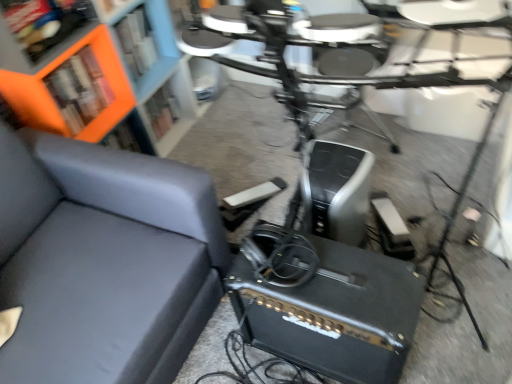
Question: Can we say orange matte bookcase at upper left lies outside matte gray couch at left?

Choices:
 (A) yes
 (B) no

Answer: (A)

Question: Does orange matte bookcase at upper left have a lesser width compared to matte gray couch at left?

Choices:
 (A) yes
 (B) no

Answer: (A)

Question: Does orange matte bookcase at upper left have a smaller size compared to matte gray couch at left?

Choices:
 (A) yes
 (B) no

Answer: (A)

Question: Is orange matte bookcase at upper left looking in the opposite direction of matte gray couch at left?

Choices:
 (A) no
 (B) yes

Answer: (A)

Question: Does orange matte bookcase at upper left lie in front of matte gray couch at left?

Choices:
 (A) yes
 (B) no

Answer: (B)

Question: Considering their positions, is orange matte bookshelf at upper left located in front of or behind matte gray couch at left?

Choices:
 (A) behind
 (B) front

Answer: (A)

Question: Considering the positions of orange matte bookshelf at upper left and matte gray couch at left in the image, is orange matte bookshelf at upper left wider or thinner than matte gray couch at left?

Choices:
 (A) wide
 (B) thin

Answer: (B)

Question: In terms of height, does orange matte bookshelf at upper left look taller or shorter compared to matte gray couch at left?

Choices:
 (A) tall
 (B) short

Answer: (B)

Question: Considering the positions of point (156, 132) and point (123, 309), is point (156, 132) closer or farther from the camera than point (123, 309)?

Choices:
 (A) farther
 (B) closer

Answer: (A)

Question: Considering the positions of orange matte bookshelf at upper left and black matte speaker at lower center in the image, is orange matte bookshelf at upper left wider or thinner than black matte speaker at lower center?

Choices:
 (A) thin
 (B) wide

Answer: (A)

Question: In terms of size, does orange matte bookshelf at upper left appear bigger or smaller than black matte speaker at lower center?

Choices:
 (A) big
 (B) small

Answer: (B)

Question: In the image, is orange matte bookshelf at upper left on the left side or the right side of black matte speaker at lower center?

Choices:
 (A) right
 (B) left

Answer: (B)

Question: From the image's perspective, is orange matte bookshelf at upper left located above or below black matte speaker at lower center?

Choices:
 (A) above
 (B) below

Answer: (A)

Question: Would you say orange matte bookcase at upper left is to the left or to the right of matte gray couch at left in the picture?

Choices:
 (A) right
 (B) left

Answer: (A)

Question: From the image's perspective, relative to matte gray couch at left, is orange matte bookcase at upper left above or below?

Choices:
 (A) below
 (B) above

Answer: (B)